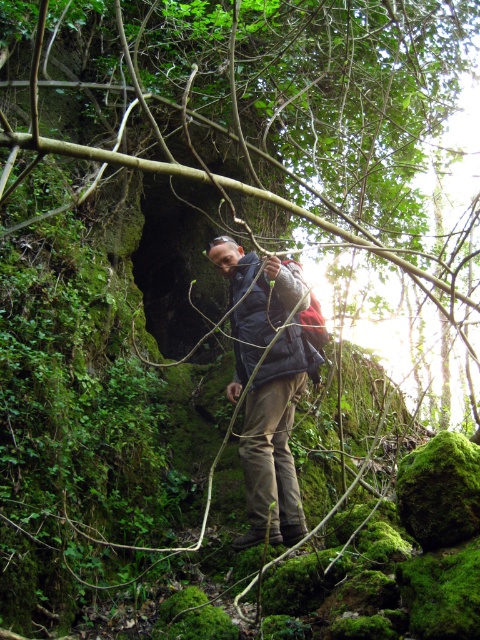
You are a photographer trying to capture the person in the scene. You notice two dark blue jackets at the center. Which one is closer to you, the dark blue jacket at center or the dark blue fabric jacket at center?

The dark blue jacket at center is closer to the viewer than the dark blue fabric jacket at center.

You are a hiker who wants to place a small GPS marker on the ground near the green mossy rock at center. According to the coordinates provided, where should you place it?

The green mossy rock at center is located at point (236,132), so you should place the GPS marker near that coordinate.

You are a hiker who wants to sit down for a rest. You see a green mossy rock at center and a dark blue jacket at center. Which object can you sit on without needing to climb over something first?

The green mossy rock at center has a greater height compared to the dark blue jacket at center, so you can sit on the dark blue jacket at center without needing to climb over something first.